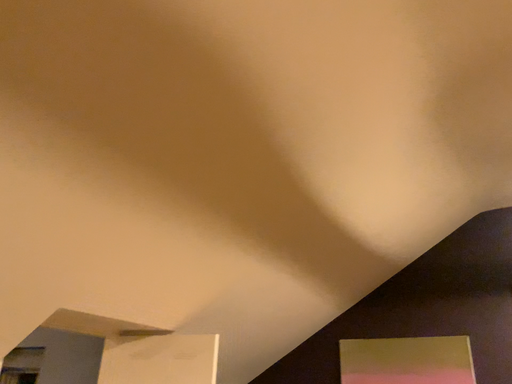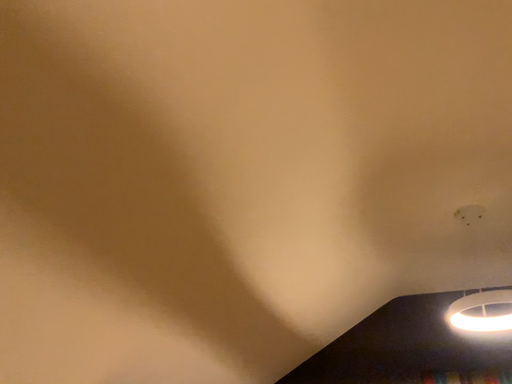
Question: Which way did the camera rotate in the video?

Choices:
 (A) rotated upward
 (B) rotated downward

Answer: (A)